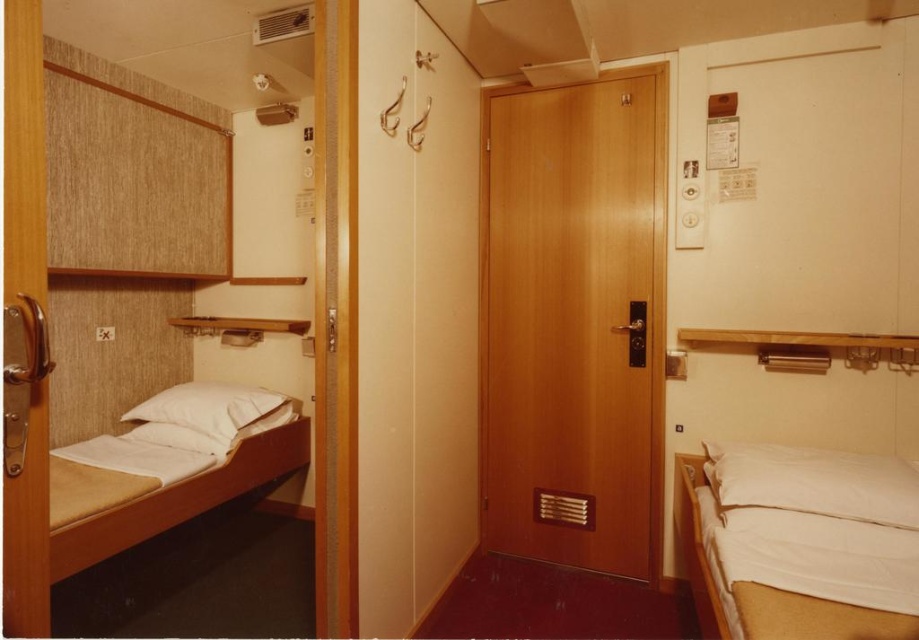
Can you confirm if white soft pillow at right is bigger than white soft pillow at left?

Indeed, white soft pillow at right has a larger size compared to white soft pillow at left.

Looking at this image, is white soft pillow at right in front of white soft pillow at left?

That is True.

Is point (809, 500) positioned behind point (183, 422)?

No.

Image resolution: width=919 pixels, height=640 pixels. I want to click on white soft pillow at right, so click(x=814, y=483).

Which is in front, point (273, 412) or point (722, 484)?

Point (722, 484) is more forward.

Can you confirm if white matte bed at left is positioned below white soft pillow at right?

No.

Describe the element at coordinates (163, 477) in the screenshot. I see `white matte bed at left` at that location.

At what (x,y) coordinates should I click in order to perform the action: click on white matte bed at left. Please return your answer as a coordinate pair (x, y). Looking at the image, I should click on (163, 477).

Can you confirm if white matte bed at right is taller than white matte bed at left?

Indeed, white matte bed at right has a greater height compared to white matte bed at left.

Between white matte bed at right and white matte bed at left, which one is positioned higher?

white matte bed at left

What are the coordinates of `white matte bed at right` in the screenshot? It's located at (803, 541).